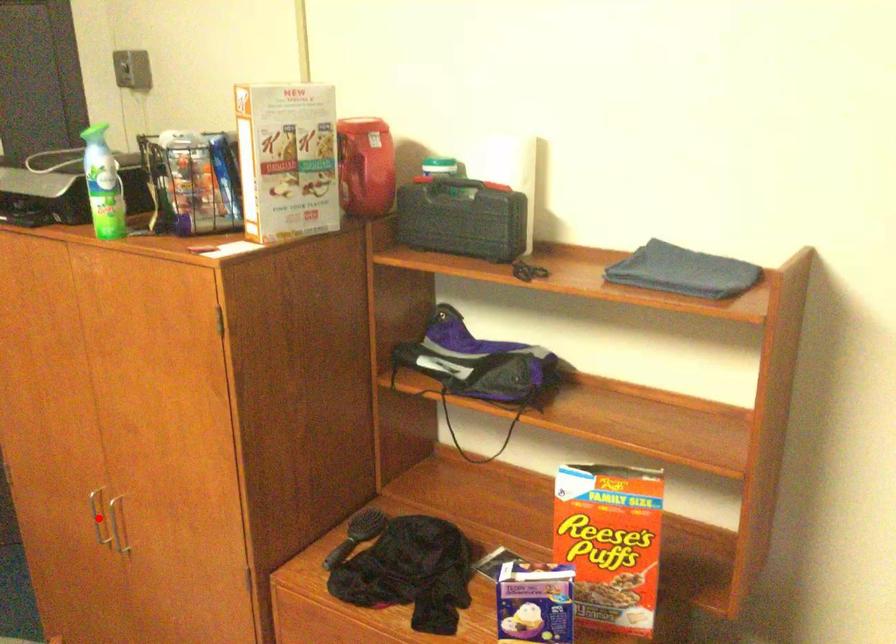
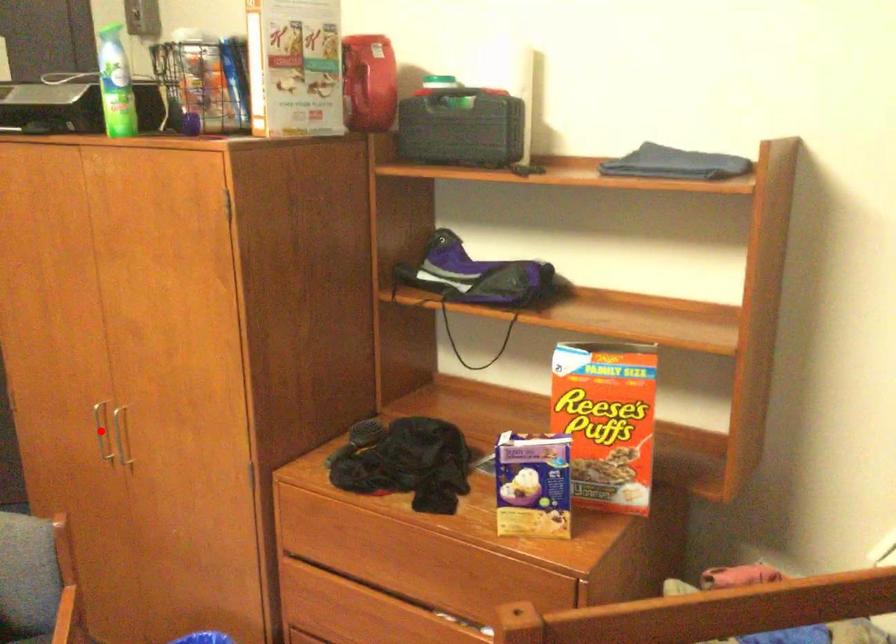
I am providing you with two images of the same scene from different viewpoints. A red point is marked on the first image and another point is marked on the second image. Are the points marked in image1 and image2 representing the same 3D position?

Yes